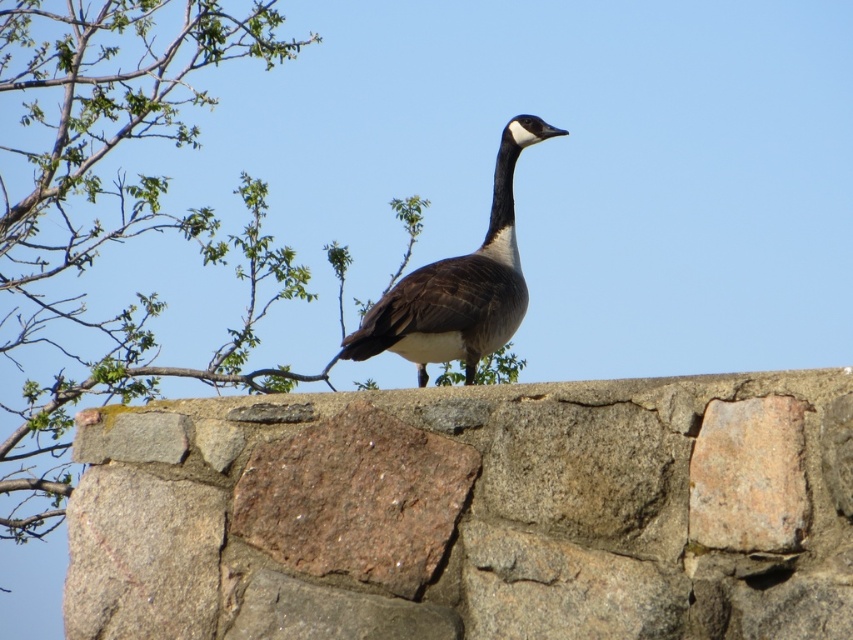
Who is lower down, brown rough stone at center or dark brown feathered goose at center?

Positioned lower is brown rough stone at center.

Who is positioned more to the right, brown rough stone at center or dark brown feathered goose at center?

Positioned to the right is dark brown feathered goose at center.

Is point (286, 529) positioned before point (444, 317)?

Yes, point (286, 529) is in front of point (444, 317).

Where is `brown rough stone at center`? The height and width of the screenshot is (640, 853). brown rough stone at center is located at coordinates (471, 513).

Based on the photo, how far apart are brown rough stone at center and green leafy branches at upper left?

4.86 meters

Can you confirm if brown rough stone at center is positioned below green leafy branches at upper left?

Indeed, brown rough stone at center is positioned under green leafy branches at upper left.

Does point (527, 394) lie behind point (248, 320)?

No, it is not.

Find the location of a particular element. The height and width of the screenshot is (640, 853). brown rough stone at center is located at coordinates [471, 513].

In the scene shown: Can you confirm if green leafy branches at upper left is taller than dark brown feathered goose at center?

Indeed, green leafy branches at upper left has a greater height compared to dark brown feathered goose at center.

Can you confirm if green leafy branches at upper left is positioned to the left of dark brown feathered goose at center?

Yes, green leafy branches at upper left is to the left of dark brown feathered goose at center.

Where is `green leafy branches at upper left`? green leafy branches at upper left is located at coordinates (115, 216).